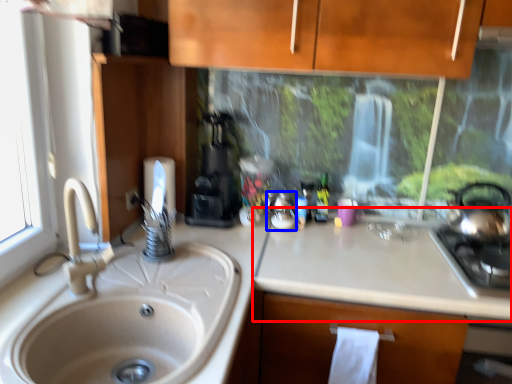
Question: Which object appears closest to the camera in this image, counter top (highlighted by a red box) or appliance (highlighted by a blue box)?

Choices:
 (A) counter top
 (B) appliance

Answer: (A)